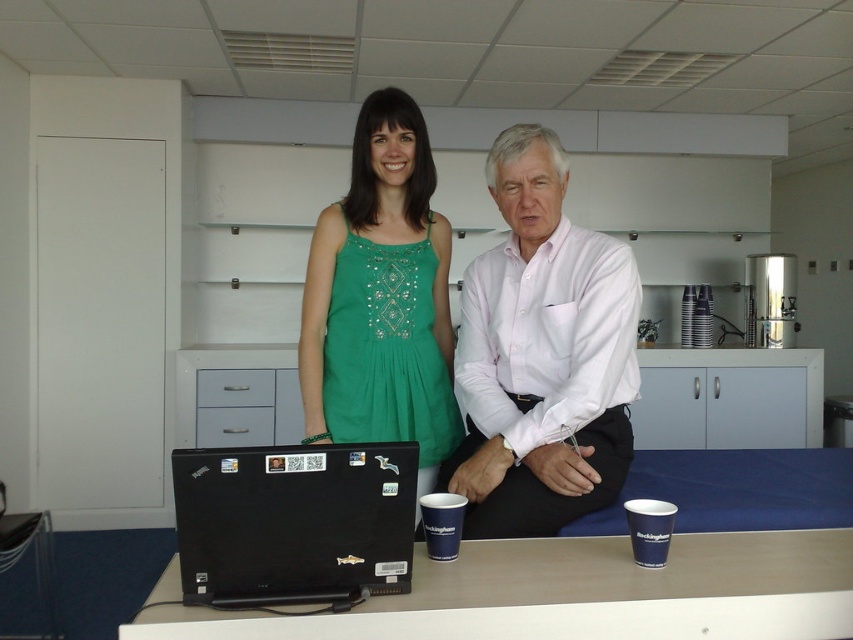
Question: Which point is farther from the camera taking this photo?

Choices:
 (A) (583, 566)
 (B) (256, 509)

Answer: (A)

Question: Is white cotton shirt at center wider than black matte laptop at center?

Choices:
 (A) yes
 (B) no

Answer: (A)

Question: Which point is farther to the camera?

Choices:
 (A) black plastic laptop at center
 (B) black matte laptop at center
 (C) white cotton shirt at center
 (D) green embroidered dress at center

Answer: (D)

Question: Based on their relative distances, which object is nearer to the black plastic laptop at center?

Choices:
 (A) black matte laptop at center
 (B) green embroidered dress at center
 (C) white cotton shirt at center

Answer: (A)

Question: Is green embroidered dress at center positioned before black matte laptop at center?

Choices:
 (A) yes
 (B) no

Answer: (B)

Question: Is green embroidered dress at center closer to camera compared to black matte laptop at center?

Choices:
 (A) yes
 (B) no

Answer: (B)